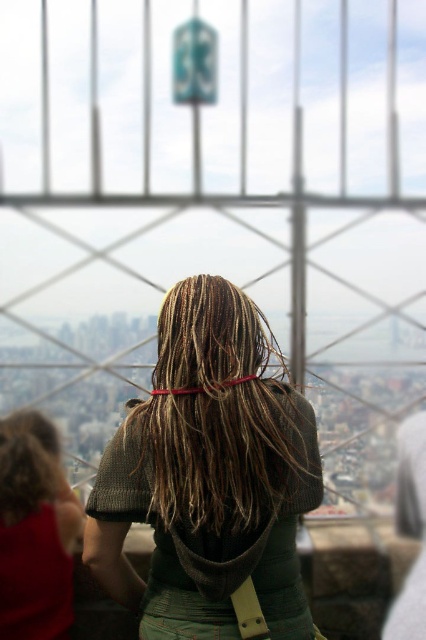
Question: Observing the image, what is the correct spatial positioning of brown/dry hair at center in reference to matte green shirt at lower left?

Choices:
 (A) right
 (B) left

Answer: (A)

Question: Is brown/dry hair at center closer to the viewer compared to curly brown hair at lower left?

Choices:
 (A) no
 (B) yes

Answer: (B)

Question: Is brown/dry hair at center closer to the viewer compared to matte green shirt at lower left?

Choices:
 (A) no
 (B) yes

Answer: (B)

Question: Estimate the real-world distances between objects in this image. Which object is closer to the matte green shirt at lower left?

Choices:
 (A) brown/dry hair at center
 (B) curly brown hair at lower left

Answer: (B)

Question: Which object appears closest to the camera in this image?

Choices:
 (A) matte green shirt at lower left
 (B) brown/dry hair at center

Answer: (B)

Question: Which point is farther to the camera?

Choices:
 (A) brown/dry hair at center
 (B) curly brown hair at lower left
 (C) matte green shirt at lower left

Answer: (B)